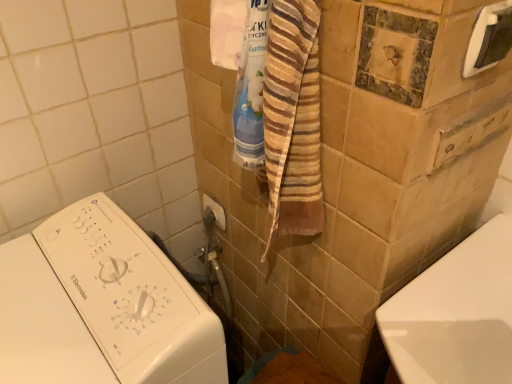
Measure the distance between white plastic washing machine at left and camera.

A distance of 21.08 inches exists between white plastic washing machine at left and camera.

At what (x,y) coordinates should I click in order to perform the action: click on white plastic towel bar at upper right, the 2th towel bar positioned from the back. Please return your answer as a coordinate pair (x, y). Image resolution: width=512 pixels, height=384 pixels. Looking at the image, I should click on (489, 38).

In order to face metallic silver towel bar at upper center, positioned as the 2th towel bar in top-to-bottom order, should I rotate leftwards or rightwards?

You should rotate left by 5.444 degrees.

You are a GUI agent. You are given a task and a screenshot of the screen. Output one action in this format:
    pyautogui.click(x=<x>, y=<y>)
    Task: Click on the white plastic washing machine at left
    
    Given the screenshot: What is the action you would take?
    pyautogui.click(x=101, y=306)

Relative to metallic silver towel bar at upper center, arranged as the first towel bar when viewed from the left, is white plastic washing machine at left in front or behind?

Visually, white plastic washing machine at left is located in front of metallic silver towel bar at upper center, arranged as the first towel bar when viewed from the left.

Can you confirm if white plastic washing machine at left is positioned to the right of metallic silver towel bar at upper center, arranged as the first towel bar when viewed from the left?

No.

Where is `the 1st towel bar above the white plastic washing machine at left (from the image's perspective)`? This screenshot has width=512, height=384. the 1st towel bar above the white plastic washing machine at left (from the image's perspective) is located at coordinates (215, 211).

From the picture: Is white plastic washing machine at left taller or shorter than metallic silver towel bar at upper center, which is counted as the 2th towel bar, starting from the front?

Considering their sizes, white plastic washing machine at left has more height than metallic silver towel bar at upper center, which is counted as the 2th towel bar, starting from the front.

Is point (224, 228) positioned after point (101, 311)?

Yes, it is behind point (101, 311).

Which of these two, metallic silver towel bar at upper center, which appears as the first towel bar when ordered from the bottom, or white plastic washing machine at left, is wider?

Wider between the two is white plastic washing machine at left.

Is metallic silver towel bar at upper center, which is counted as the 2th towel bar, starting from the front, taller than white plastic washing machine at left?

In fact, metallic silver towel bar at upper center, which is counted as the 2th towel bar, starting from the front, may be shorter than white plastic washing machine at left.

From the picture: Is metallic silver towel bar at upper center, which appears as the first towel bar when ordered from the bottom, oriented away from white plastic washing machine at left?

No.

This screenshot has width=512, height=384. Identify the location of towel bar that appears on the right of metallic silver towel bar at upper center, the first towel bar in the back-to-front sequence. (489, 38).

Considering the relative sizes of white plastic towel bar at upper right, which ranks as the second towel bar in bottom-to-top order, and metallic silver towel bar at upper center, placed as the 2th towel bar when sorted from right to left, in the image provided, is white plastic towel bar at upper right, which ranks as the second towel bar in bottom-to-top order, wider than metallic silver towel bar at upper center, placed as the 2th towel bar when sorted from right to left,?

Incorrect, the width of white plastic towel bar at upper right, which ranks as the second towel bar in bottom-to-top order, does not surpass that of metallic silver towel bar at upper center, placed as the 2th towel bar when sorted from right to left.

Is white plastic towel bar at upper right, which is the second towel bar in left-to-right order, far away from metallic silver towel bar at upper center, arranged as the first towel bar when viewed from the left?

Actually, white plastic towel bar at upper right, which is the second towel bar in left-to-right order, and metallic silver towel bar at upper center, arranged as the first towel bar when viewed from the left, are a little close together.

Does white plastic towel bar at upper right, which is the second towel bar in left-to-right order, turn towards white plastic washing machine at left?

No, white plastic towel bar at upper right, which is the second towel bar in left-to-right order, is not oriented towards white plastic washing machine at left.

Considering the positions of points (477, 30) and (204, 329), is point (477, 30) closer to camera compared to point (204, 329)?

Yes.

Which object is closer to the camera, white plastic towel bar at upper right, the 1th towel bar when ordered from top to bottom, or white plastic washing machine at left?

white plastic washing machine at left is closer to the camera.

You are a GUI agent. You are given a task and a screenshot of the screen. Output one action in this format:
    pyautogui.click(x=<x>, y=<y>)
    Task: Click on the 2nd towel bar above the white plastic washing machine at left (from the image's perspective)
    The height and width of the screenshot is (384, 512).
    Given the screenshot: What is the action you would take?
    pyautogui.click(x=489, y=38)

Is point (223, 219) more distant than point (507, 11)?

That is True.

Considering the sizes of objects metallic silver towel bar at upper center, placed as the 2th towel bar when sorted from right to left, and white plastic towel bar at upper right, the 2th towel bar positioned from the back, in the image provided, who is smaller, metallic silver towel bar at upper center, placed as the 2th towel bar when sorted from right to left, or white plastic towel bar at upper right, the 2th towel bar positioned from the back,?

With smaller size is metallic silver towel bar at upper center, placed as the 2th towel bar when sorted from right to left.

Does metallic silver towel bar at upper center, which is counted as the 2th towel bar, starting from the front, appear on the right side of white plastic towel bar at upper right, which is the second towel bar in left-to-right order?

No, metallic silver towel bar at upper center, which is counted as the 2th towel bar, starting from the front, is not to the right of white plastic towel bar at upper right, which is the second towel bar in left-to-right order.

Does metallic silver towel bar at upper center, positioned as the 2th towel bar in top-to-bottom order, have a lesser width compared to white plastic towel bar at upper right, marked as the 1th towel bar in a right-to-left arrangement?

No.

Which object is positioned more to the left, white plastic washing machine at left or white plastic towel bar at upper right, the 1th towel bar when ordered from top to bottom?

From the viewer's perspective, white plastic washing machine at left appears more on the left side.

Between point (87, 239) and point (499, 24), which one is positioned in front?

The point (499, 24) is in front.

From the image's perspective, would you say white plastic washing machine at left is positioned over white plastic towel bar at upper right, which ranks as the second towel bar in bottom-to-top order?

Result: Actually, white plastic washing machine at left appears below white plastic towel bar at upper right, which ranks as the second towel bar in bottom-to-top order, in the image.

Which towel bar is the 2nd one when counting from the back of the white plastic washing machine at left? Please provide its 2D coordinates.

[(215, 211)]

Identify the location of washing machine in front of the metallic silver towel bar at upper center, the first towel bar in the back-to-front sequence. This screenshot has height=384, width=512. (101, 306).

Estimate the real-world distances between objects in this image. Which object is closer to metallic silver towel bar at upper center, positioned as the 2th towel bar in top-to-bottom order, white plastic towel bar at upper right, which is the second towel bar in left-to-right order, or white plastic washing machine at left?

Based on the image, white plastic washing machine at left appears to be nearer to metallic silver towel bar at upper center, positioned as the 2th towel bar in top-to-bottom order.

Based on their spatial positions, is metallic silver towel bar at upper center, which appears as the first towel bar when ordered from the bottom, or white plastic towel bar at upper right, which is the second towel bar in left-to-right order, closer to white plastic washing machine at left?

Based on the image, metallic silver towel bar at upper center, which appears as the first towel bar when ordered from the bottom, appears to be nearer to white plastic washing machine at left.

From the picture: Considering their positions, is metallic silver towel bar at upper center, placed as the 2th towel bar when sorted from right to left, positioned closer to white plastic towel bar at upper right, the 1th towel bar when ordered from top to bottom, than white plastic washing machine at left?

Based on the image, white plastic washing machine at left appears to be nearer to white plastic towel bar at upper right, the 1th towel bar when ordered from top to bottom.

Which object lies nearer to the anchor point white plastic towel bar at upper right, the 1th towel bar when ordered from top to bottom, white plastic washing machine at left or metallic silver towel bar at upper center, placed as the 2th towel bar when sorted from right to left?

Based on the image, white plastic washing machine at left appears to be nearer to white plastic towel bar at upper right, the 1th towel bar when ordered from top to bottom.

Considering their positions, is white plastic washing machine at left positioned closer to metallic silver towel bar at upper center, which is counted as the 2th towel bar, starting from the front, than white plastic towel bar at upper right, which is the second towel bar in left-to-right order?

Among the two, white plastic washing machine at left is located nearer to metallic silver towel bar at upper center, which is counted as the 2th towel bar, starting from the front.

Considering their positions, is white plastic towel bar at upper right, acting as the first towel bar starting from the front, positioned further to white plastic washing machine at left than metallic silver towel bar at upper center, which appears as the first towel bar when ordered from the bottom?

white plastic towel bar at upper right, acting as the first towel bar starting from the front, is further to white plastic washing machine at left.

You are a GUI agent. You are given a task and a screenshot of the screen. Output one action in this format:
    pyautogui.click(x=<x>, y=<y>)
    Task: Click on the towel bar located between white plastic washing machine at left and metallic silver towel bar at upper center, positioned as the 2th towel bar in top-to-bottom order, in the depth direction
    The height and width of the screenshot is (384, 512).
    Given the screenshot: What is the action you would take?
    pyautogui.click(x=489, y=38)